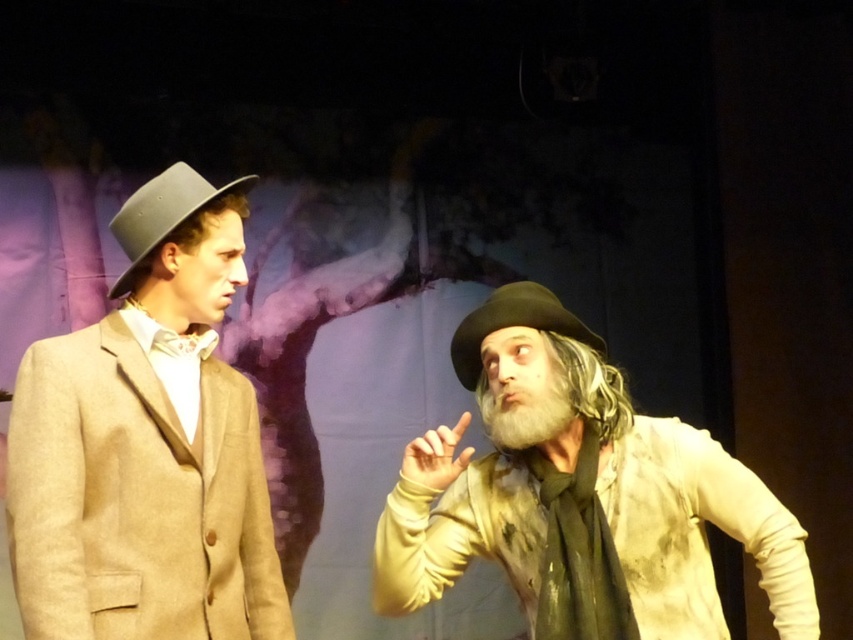
Question: Which of the following is the closest to the observer?

Choices:
 (A) (566, 406)
 (B) (643, 433)
 (C) (119, 237)

Answer: (A)

Question: Is dirty beige shirt at right above matte gray dress hat at left?

Choices:
 (A) no
 (B) yes

Answer: (A)

Question: Does dirty beige shirt at right appear over black felt dress hat at center?

Choices:
 (A) yes
 (B) no

Answer: (B)

Question: Is matte brown suit at left to the left of black felt dress hat at center from the viewer's perspective?

Choices:
 (A) yes
 (B) no

Answer: (A)

Question: Which point is farther to the camera?

Choices:
 (A) white fuzzy beard at right
 (B) matte gray dress hat at left
 (C) dirty beige shirt at right
 (D) black felt dress hat at center

Answer: (D)

Question: Considering the real-world distances, which object is farthest from the matte brown suit at left?

Choices:
 (A) white fuzzy beard at right
 (B) matte gray dress hat at left
 (C) black felt dress hat at center
 (D) dirty beige shirt at right

Answer: (A)